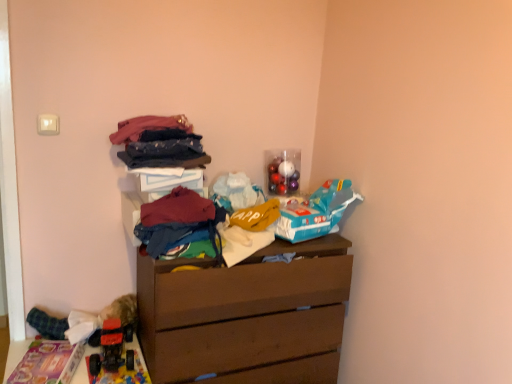
Identify the location of vacant space in rubberized red toy truck at lower left, which is counted as the 1th toy, starting from the bottom (from a real-world perspective). (112, 359).